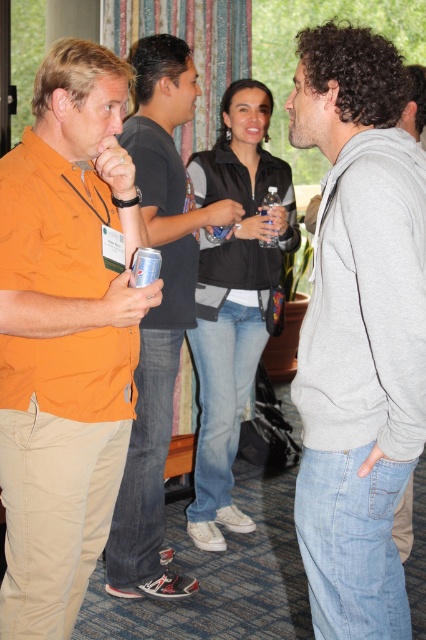
Does gray cotton hoodie at center have a lesser height compared to clear plastic bottle at center?

In fact, gray cotton hoodie at center may be taller than clear plastic bottle at center.

Is gray cotton hoodie at center wider than clear plastic bottle at center?

Yes, gray cotton hoodie at center is wider than clear plastic bottle at center.

What are the coordinates of `gray cotton hoodie at center` in the screenshot? It's located at (359, 332).

The image size is (426, 640). Identify the location of gray cotton hoodie at center. (359, 332).

Can you confirm if orange cotton shirt at left is wider than gray cotton hoodie at center?

Yes, orange cotton shirt at left is wider than gray cotton hoodie at center.

Which of these two, orange cotton shirt at left or gray cotton hoodie at center, stands taller?

orange cotton shirt at left

Which is behind, point (97, 308) or point (347, 472)?

Point (97, 308)

Identify the location of orange cotton shirt at left. Image resolution: width=426 pixels, height=640 pixels. (66, 333).

Who is taller, gray cotton hoodie at center or orange matte shirt at left?

orange matte shirt at left is taller.

Which of these two, gray cotton hoodie at center or orange matte shirt at left, stands shorter?

With less height is gray cotton hoodie at center.

Who is more forward, (399, 371) or (172, 106)?

Point (399, 371) is more forward.

The image size is (426, 640). I want to click on gray cotton hoodie at center, so click(x=359, y=332).